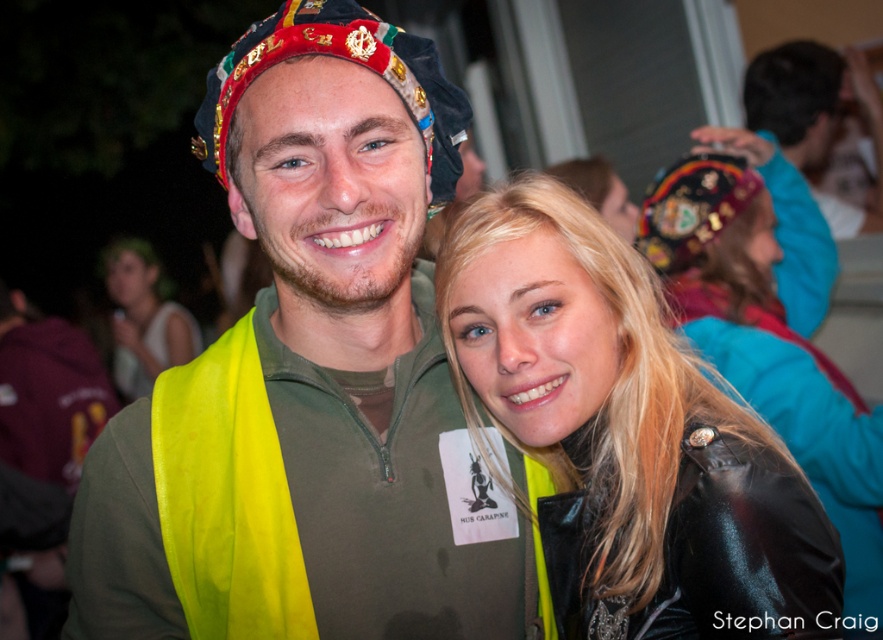
You are a photographer standing at the center of the scene. You want to take a photo of the black leather jacket at upper right and the man on the left. Since you can only focus on one subject at a time, which subject should you choose to ensure both are in focus? Explain your reasoning based on their distance from you.

The black leather jacket at upper right is 1.91 meters away from the man on the left. Since you are standing at the center, the distance from you to each subject would be roughly half of that, approximately 0.955 meters. With a standard camera lens, if you focus on the closer subject, the depth of field might not cover both. However, since both are relatively close to you and the distance between them is small, focusing on either subject should keep both in focus due to the shallow depth of field at close

You are standing in front of the scene and notice two points marked in the image. Which point, point (785, 285) or point (768, 96), is closer to you?

Point (785, 285) is closer to the viewer than point (768, 96).

You are a photographer trying to capture a clear shot of both the black leather jacket at upper right and the matte yellow vest at center. Based on their positions, which item is closer to the camera?

The black leather jacket at upper right is below the matte yellow vest at center, meaning it is closer to the camera.